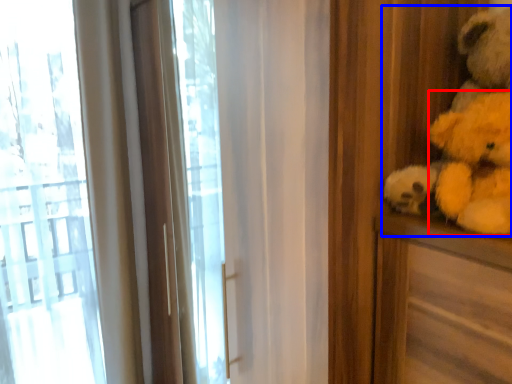
Question: Which of the following is the closest to the observer, animal (highlighted by a red box) or teddy bear (highlighted by a blue box)?

Choices:
 (A) animal
 (B) teddy bear

Answer: (A)